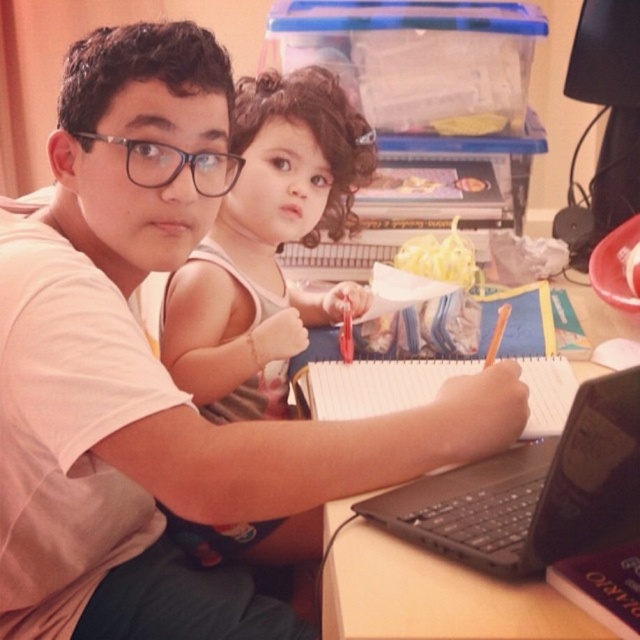
Between smooth beige tank top at upper center and black plastic laptop at center, which one appears on the left side from the viewer's perspective?

smooth beige tank top at upper center is more to the left.

Does point (292, 92) come closer to viewer compared to point (525, 572)?

No, (292, 92) is behind (525, 572).

Locate an element on the screen. smooth beige tank top at upper center is located at coordinates (266, 244).

Can you confirm if smooth beige tank top at upper center is positioned below wooden table at center?

No.

Between smooth beige tank top at upper center and wooden table at center, which one is positioned higher?

smooth beige tank top at upper center is higher up.

The image size is (640, 640). What do you see at coordinates (266, 244) in the screenshot?
I see `smooth beige tank top at upper center` at bounding box center [266, 244].

Find the location of a particular element. smooth beige tank top at upper center is located at coordinates (266, 244).

Looking at this image, does black plastic laptop at center have a lesser width compared to wooden table at center?

No.

Does black plastic laptop at center appear on the right side of wooden table at center?

Correct, you'll find black plastic laptop at center to the right of wooden table at center.

Who is more forward, (557, 540) or (360, 497)?

Point (557, 540)

The height and width of the screenshot is (640, 640). In order to click on black plastic laptop at center in this screenshot , I will do `click(531, 490)`.